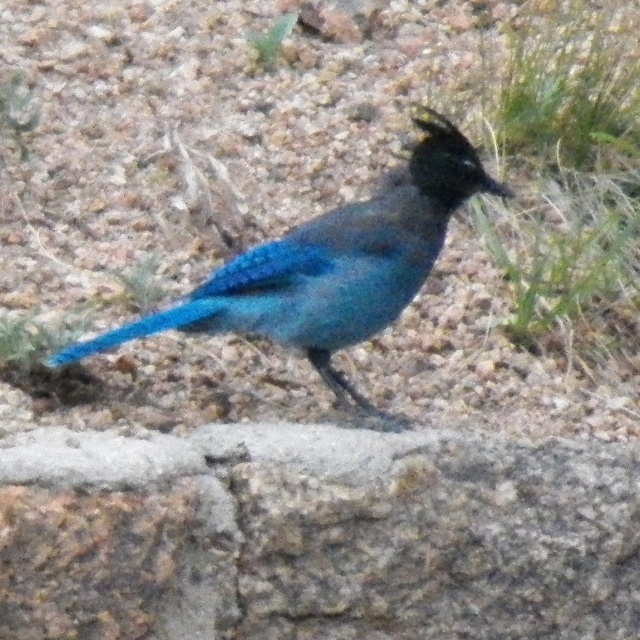
Question: Is granite rock at center to the left of shiny blue bird at center from the viewer's perspective?

Choices:
 (A) no
 (B) yes

Answer: (B)

Question: Among these objects, which one is nearest to the camera?

Choices:
 (A) granite rock at center
 (B) shiny blue bird at center

Answer: (A)

Question: Does granite rock at center lie in front of shiny blue bird at center?

Choices:
 (A) yes
 (B) no

Answer: (A)

Question: Is granite rock at center below shiny blue bird at center?

Choices:
 (A) yes
 (B) no

Answer: (A)